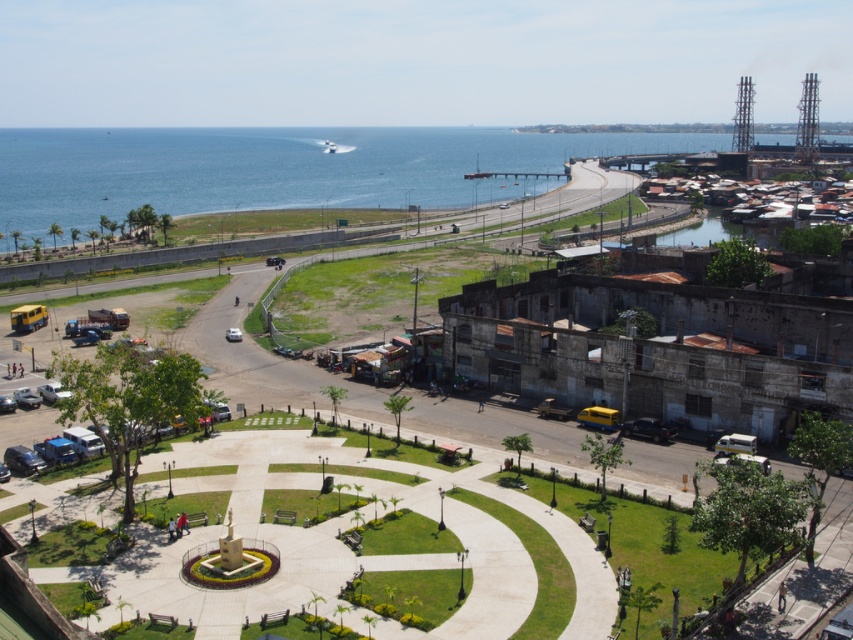
Which is below, blue water at lower left or white matte car at center?

white matte car at center

Is blue water at lower left thinner than white matte car at center?

A: No.

Is point (51, 212) more distant than point (224, 337)?

Yes, it is.

Locate an element on the screen. The width and height of the screenshot is (853, 640). blue water at lower left is located at coordinates (280, 168).